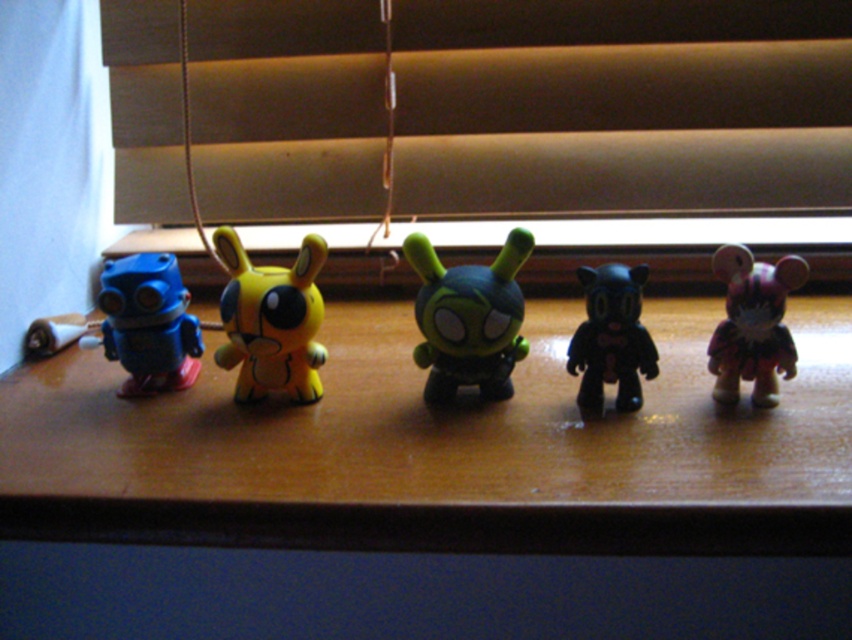
You are a small toy collector who wants to place a new 3.5 inch wide decorative item between the green matte toy at center and the yellow matte pikachu at center. Based on the space between them, will the new item fit without overlapping either?

The distance between the green matte toy at center and the yellow matte pikachu at center is 5.09 inches. Since the new item is 3.5 inches wide, it can fit in the space between them without overlapping as 3.5 is less than 5.09.

You are a photographer setting up a shot of the wooden table at center. The brown matte blinds at upper center are blocking some light. To get better lighting, should you move the table forward or backward relative to the blinds?

The wooden table at center is already in front of the brown matte blinds at upper center. Moving it backward would place it closer to the blinds, potentially worsening the light obstruction. To improve lighting, consider moving the table forward away from the blinds or adjusting the blinds themselves.